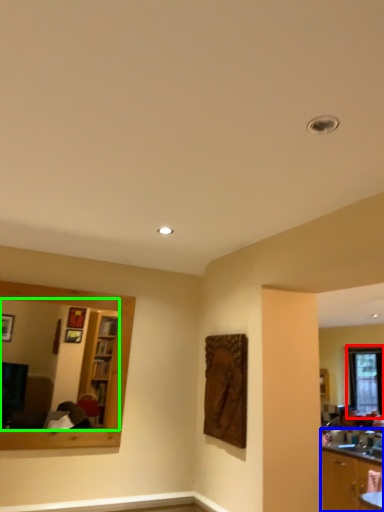
Question: Which object is positioned closest to window (highlighted by a red box)? Select from cabinetry (highlighted by a blue box) and mirror (highlighted by a green box).

Choices:
 (A) cabinetry
 (B) mirror

Answer: (A)